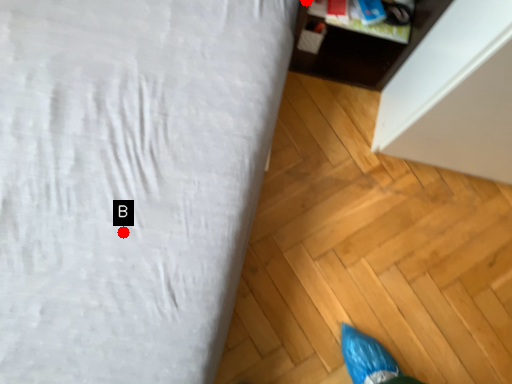
Question: Two points are circled on the image, labeled by A and B beside each circle. Among these points, which one is farthest from the camera?

Choices:
 (A) A is further
 (B) B is further

Answer: (A)